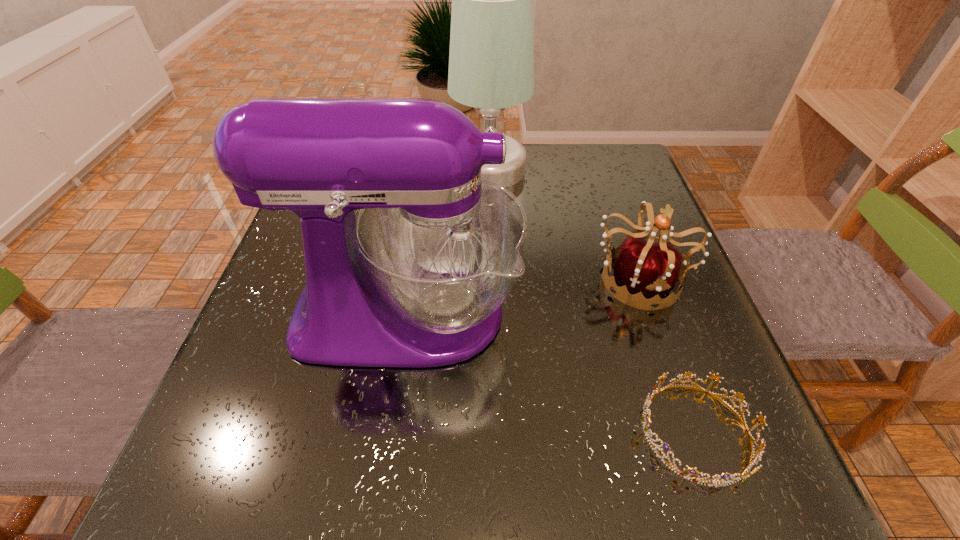
Where is `lampshade`? The image size is (960, 540). lampshade is located at coordinates (491, 62).

Where is `mixer`? Image resolution: width=960 pixels, height=540 pixels. mixer is located at coordinates (417, 279).

This screenshot has width=960, height=540. In order to click on the taller tiara in this screenshot , I will do `click(646, 268)`.

You are a GUI agent. You are given a task and a screenshot of the screen. Output one action in this format:
    pyautogui.click(x=<x>, y=<y>)
    Task: Click on the farther tiara
    
    Given the screenshot: What is the action you would take?
    pyautogui.click(x=646, y=268)

Where is `the nearest object`? This screenshot has height=540, width=960. the nearest object is located at coordinates (757, 457).

Find the location of `the shorter tiara`. the shorter tiara is located at coordinates (757, 457).

Find the location of a particular element. vacant space situated on the base of the farthest object is located at coordinates (386, 169).

Where is `vacant space positioned 0.140m on the base of the farthest object`? vacant space positioned 0.140m on the base of the farthest object is located at coordinates click(x=400, y=169).

Where is `free location located on the base of the farthest object`? The image size is (960, 540). free location located on the base of the farthest object is located at coordinates (422, 169).

Where is `vacant point located at the bowl opening of the mixer`? Image resolution: width=960 pixels, height=540 pixels. vacant point located at the bowl opening of the mixer is located at coordinates (576, 314).